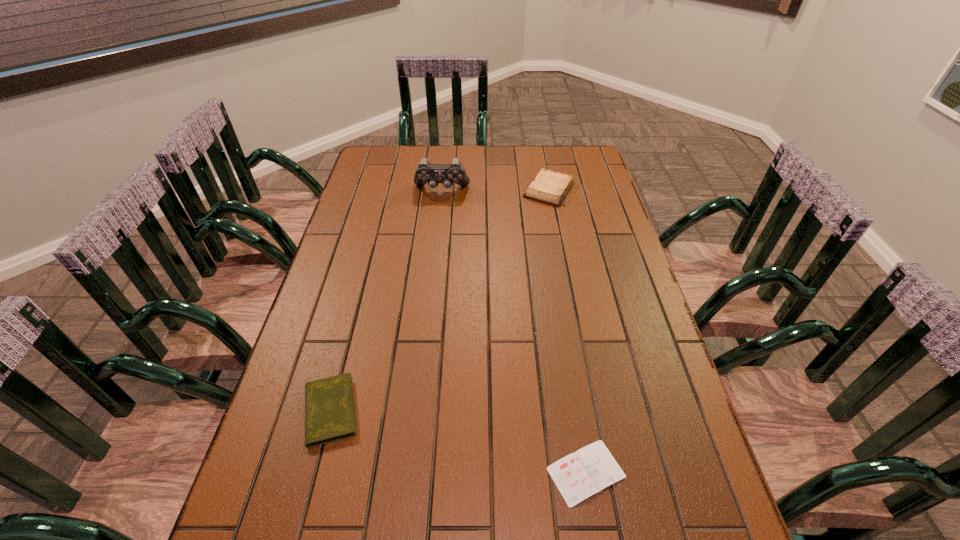
Where is `the third object from right to left`? the third object from right to left is located at coordinates (425, 173).

You are a GUI agent. You are given a task and a screenshot of the screen. Output one action in this format:
    pyautogui.click(x=<x>, y=<y>)
    Task: Click on the tallest object
    
    Given the screenshot: What is the action you would take?
    pyautogui.click(x=425, y=173)

This screenshot has height=540, width=960. I want to click on the farthest diary, so click(550, 187).

Where is `the third shortest object`? The height and width of the screenshot is (540, 960). the third shortest object is located at coordinates (550, 187).

I want to click on the second tallest diary, so click(329, 403).

Where is `the leftmost diary`? the leftmost diary is located at coordinates (329, 403).

Find the location of `the shortest diary`. the shortest diary is located at coordinates (579, 475).

Where is `vacant space located on the surface of the tallest object with buttons`? vacant space located on the surface of the tallest object with buttons is located at coordinates pos(437,237).

This screenshot has height=540, width=960. I want to click on blank space located 0.150m on the left of the farthest diary, so click(481, 190).

Find the location of a particular element. vacant space located on the front of the second tallest diary is located at coordinates (315, 472).